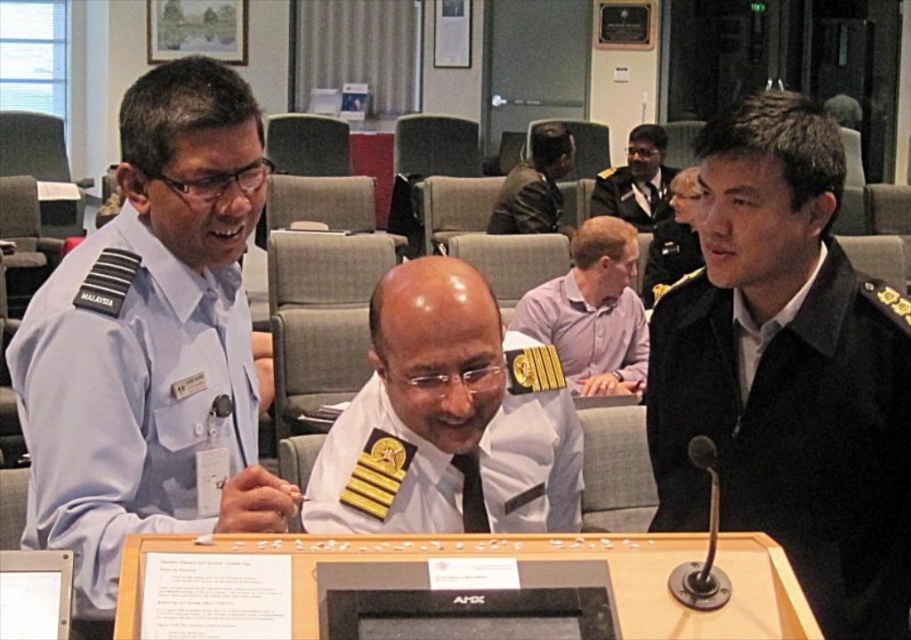
Is point (140, 326) positioned after point (537, 145)?

No, (140, 326) is closer to viewer.

Find the location of a particular element. This screenshot has height=640, width=911. light blue fabric uniform at left is located at coordinates (128, 397).

Who is more forward, (x=771, y=381) or (x=643, y=292)?

Point (x=771, y=381) is more forward.

Does black matte jacket at right appear under black uniform at right?

Yes.

Does point (679, 467) lie in front of point (645, 280)?

Yes.

Find the location of a particular element. black matte jacket at right is located at coordinates coord(795,435).

Between point (212, 541) and point (582, 374), which one is positioned behind?

Positioned behind is point (582, 374).

Where is `wooden table at center`? The image size is (911, 640). wooden table at center is located at coordinates (521, 563).